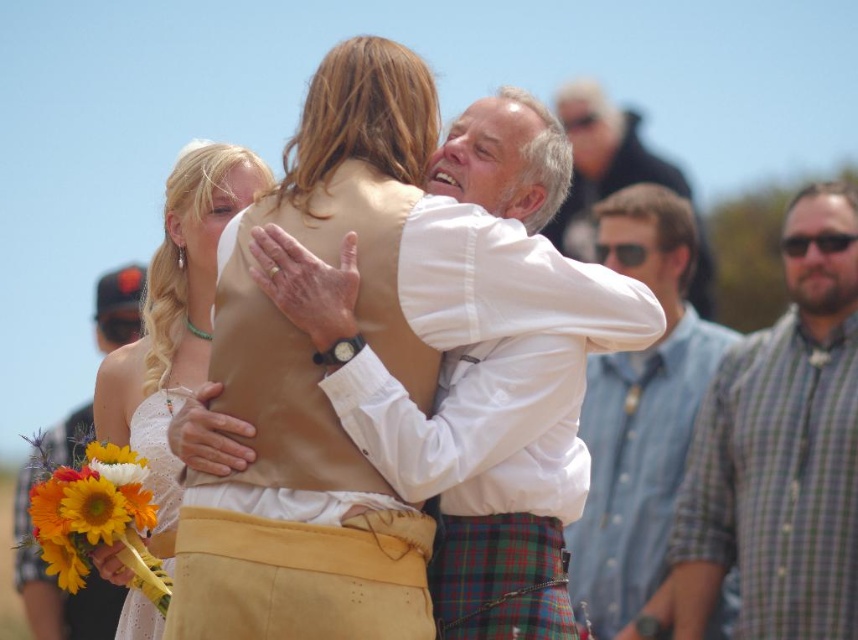
Can you confirm if white lace dress at center is taller than plaid fabric kilt at center?

Correct, white lace dress at center is much taller as plaid fabric kilt at center.

Can you confirm if white lace dress at center is smaller than plaid fabric kilt at center?

Incorrect, white lace dress at center is not smaller in size than plaid fabric kilt at center.

Does point (210, 172) lie in front of point (438, 579)?

No, it is behind (438, 579).

The width and height of the screenshot is (858, 640). In order to click on white lace dress at center in this screenshot , I will do `click(174, 314)`.

Does matte khaki vest at upper center appear under sunflower bouquet at lower left?

No, matte khaki vest at upper center is not below sunflower bouquet at lower left.

Who is positioned more to the right, matte khaki vest at upper center or sunflower bouquet at lower left?

From the viewer's perspective, matte khaki vest at upper center appears more on the right side.

Between point (591, 90) and point (101, 490), which one is positioned in front?

Point (101, 490) is more forward.

Locate an element on the screen. matte khaki vest at upper center is located at coordinates (601, 161).

Does point (346, 637) come farther from viewer compared to point (89, 509)?

That is False.

Does plaid wool kilt at center lie in front of sunflower bouquet at lower left?

Yes, it is in front of sunflower bouquet at lower left.

This screenshot has width=858, height=640. I want to click on plaid wool kilt at center, so click(x=300, y=577).